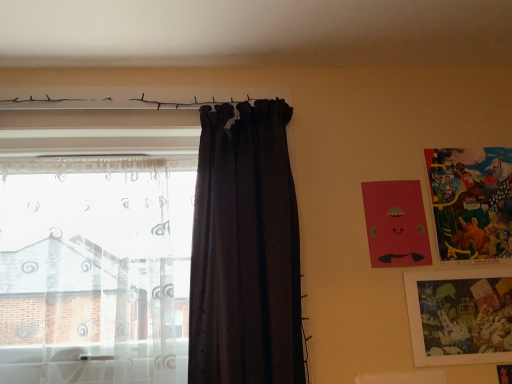
Question: Is matte plastic picture frame at lower right, which ranks as the 3th picture frame in top-to-bottom order, touching multicolored paper picture frame at upper right, acting as the third picture frame starting from the bottom?

Choices:
 (A) yes
 (B) no

Answer: (B)

Question: From a real-world perspective, is matte plastic picture frame at lower right, which ranks as the 3th picture frame in top-to-bottom order, positioned over multicolored paper picture frame at upper right, acting as the first picture frame starting from the top, based on gravity?

Choices:
 (A) yes
 (B) no

Answer: (B)

Question: Is matte plastic picture frame at lower right, which ranks as the 3th picture frame in top-to-bottom order, positioned beyond the bounds of multicolored paper picture frame at upper right, acting as the first picture frame starting from the top?

Choices:
 (A) no
 (B) yes

Answer: (B)

Question: Does matte plastic picture frame at lower right, which is counted as the first picture frame, starting from the bottom, have a greater height compared to multicolored paper picture frame at upper right, acting as the first picture frame starting from the top?

Choices:
 (A) yes
 (B) no

Answer: (B)

Question: Can you confirm if matte plastic picture frame at lower right, which is counted as the first picture frame, starting from the bottom, is positioned to the right of multicolored paper picture frame at upper right, acting as the third picture frame starting from the bottom?

Choices:
 (A) no
 (B) yes

Answer: (A)

Question: From a real-world perspective, is matte plastic picture frame at lower right, which is counted as the first picture frame, starting from the bottom, beneath multicolored paper picture frame at upper right, acting as the first picture frame starting from the top?

Choices:
 (A) yes
 (B) no

Answer: (A)

Question: From the image's perspective, is multicolored paper picture frame at upper right, acting as the first picture frame starting from the top, below transparent sheer curtain at left, the 2th curtain when ordered from right to left?

Choices:
 (A) no
 (B) yes

Answer: (A)

Question: Is multicolored paper picture frame at upper right, acting as the third picture frame starting from the bottom, outside transparent sheer curtain at left, the 1th curtain from the left?

Choices:
 (A) no
 (B) yes

Answer: (B)

Question: Does multicolored paper picture frame at upper right, acting as the third picture frame starting from the bottom, turn towards transparent sheer curtain at left, the 2th curtain when ordered from right to left?

Choices:
 (A) yes
 (B) no

Answer: (B)

Question: Is multicolored paper picture frame at upper right, acting as the third picture frame starting from the bottom, oriented away from transparent sheer curtain at left, the 1th curtain from the left?

Choices:
 (A) no
 (B) yes

Answer: (A)

Question: Can you confirm if multicolored paper picture frame at upper right, acting as the first picture frame starting from the top, is thinner than transparent sheer curtain at left, the 1th curtain from the left?

Choices:
 (A) yes
 (B) no

Answer: (A)

Question: From a real-world perspective, is multicolored paper picture frame at upper right, acting as the third picture frame starting from the bottom, on transparent sheer curtain at left, the 2th curtain when ordered from right to left?

Choices:
 (A) no
 (B) yes

Answer: (B)

Question: Considering the relative positions of matte red picture frame at upper right, marked as the second picture frame in a bottom-to-top arrangement, and transparent sheer curtain at left, the 1th curtain from the left, in the image provided, is matte red picture frame at upper right, marked as the second picture frame in a bottom-to-top arrangement, to the left of transparent sheer curtain at left, the 1th curtain from the left, from the viewer's perspective?

Choices:
 (A) no
 (B) yes

Answer: (A)